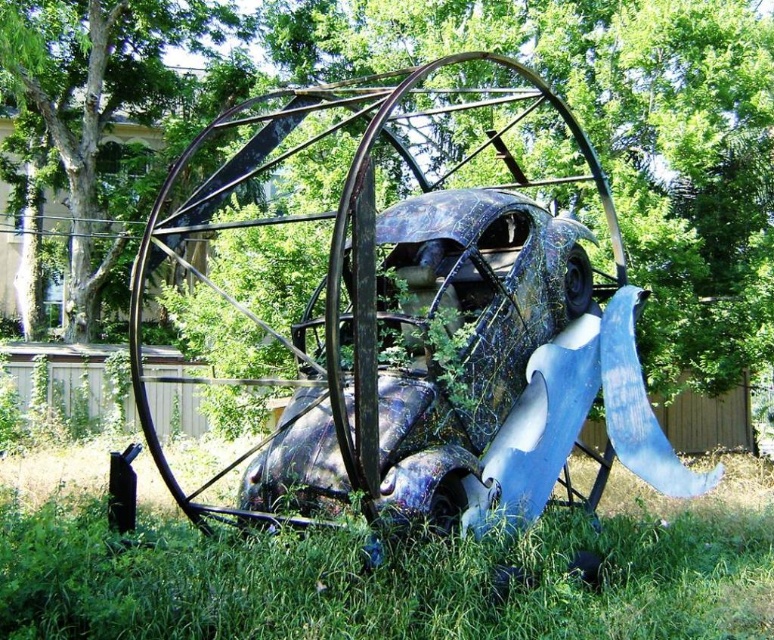
Question: Based on their relative distances, which object is farther from the green leafy tree at upper center?

Choices:
 (A) green grass at lower center
 (B) green leafy tree at center

Answer: (A)

Question: Is green leafy tree at center bigger than green leafy tree at upper center?

Choices:
 (A) yes
 (B) no

Answer: (A)

Question: Does green grass at lower center have a greater width compared to green leafy tree at upper center?

Choices:
 (A) yes
 (B) no

Answer: (A)

Question: Among these objects, which one is nearest to the camera?

Choices:
 (A) green grass at lower center
 (B) green leafy tree at center

Answer: (A)

Question: Is green leafy tree at center wider than green grass at lower center?

Choices:
 (A) yes
 (B) no

Answer: (A)

Question: Which object is farther from the camera taking this photo?

Choices:
 (A) green leafy tree at upper center
 (B) green grass at lower center
 (C) green leafy tree at center

Answer: (A)